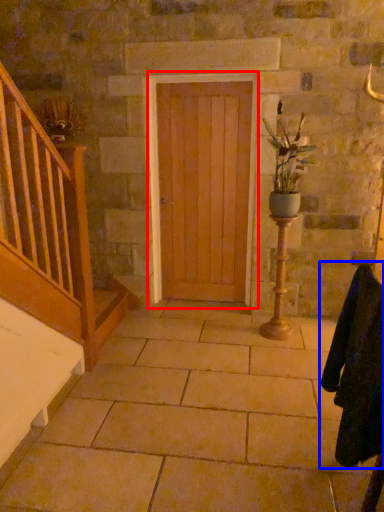
Question: Which point is further to the camera, door (highlighted by a red box) or robe (highlighted by a blue box)?

Choices:
 (A) door
 (B) robe

Answer: (A)